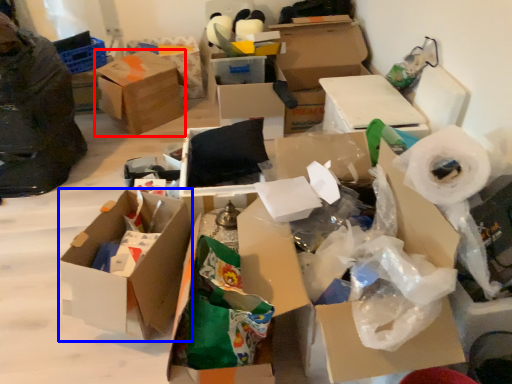
Question: Among these objects, which one is farthest to the camera, box (highlighted by a red box) or box (highlighted by a blue box)?

Choices:
 (A) box
 (B) box

Answer: (A)